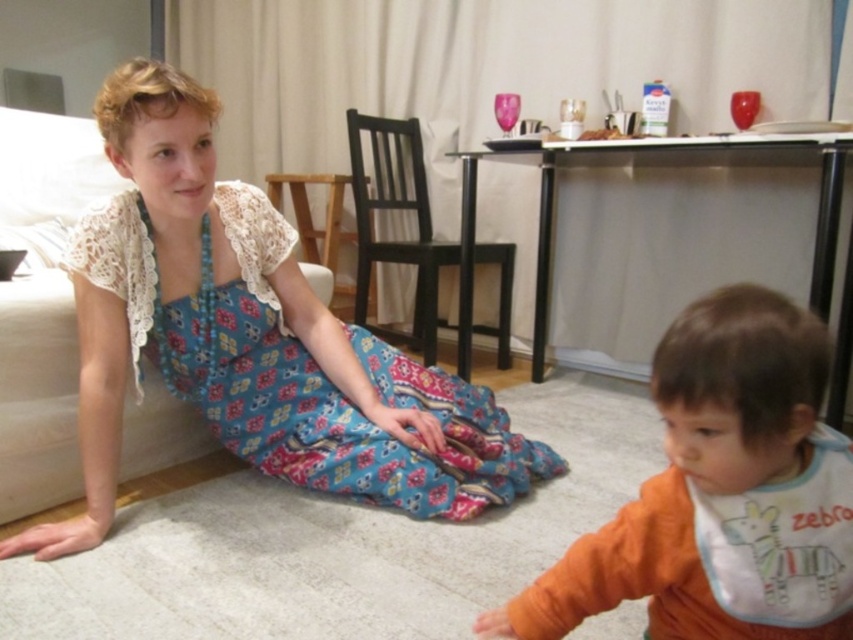
Question: Does orange fleece sweater at lower right appear under blue printed fabric dress at lower left?

Choices:
 (A) no
 (B) yes

Answer: (B)

Question: Which object is farther from the camera taking this photo?

Choices:
 (A) orange fleece sweater at lower right
 (B) white fabric bib at lower right
 (C) blue printed fabric dress at lower left

Answer: (C)

Question: Is orange fleece sweater at lower right bigger than blue printed fabric dress at lower left?

Choices:
 (A) no
 (B) yes

Answer: (A)

Question: Which object is positioned farthest from the white fabric bib at lower right?

Choices:
 (A) blue printed fabric dress at lower left
 (B) orange fleece sweater at lower right

Answer: (A)

Question: Which object appears closest to the camera in this image?

Choices:
 (A) white fabric bib at lower right
 (B) blue printed fabric dress at lower left

Answer: (A)

Question: Is orange fleece sweater at lower right bigger than white fabric bib at lower right?

Choices:
 (A) no
 (B) yes

Answer: (B)